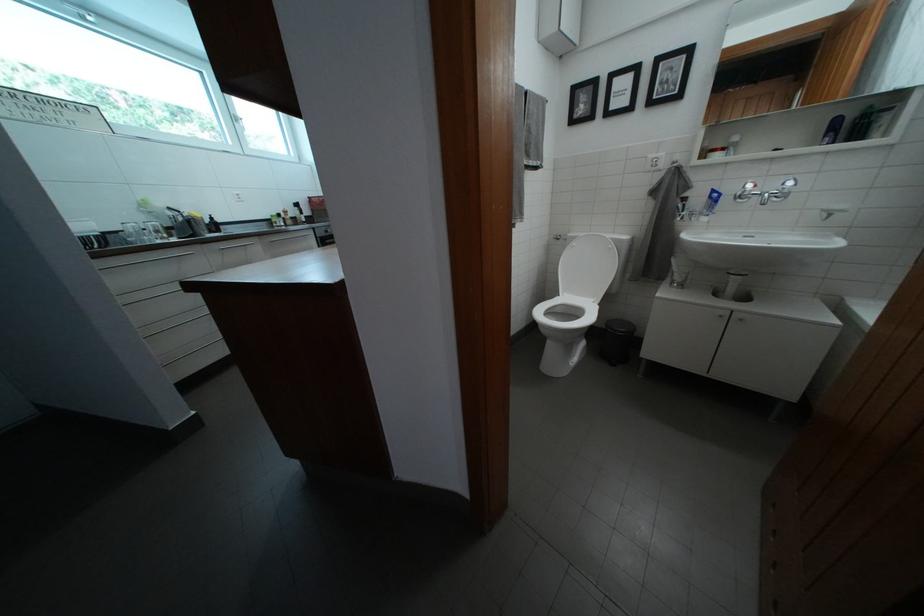
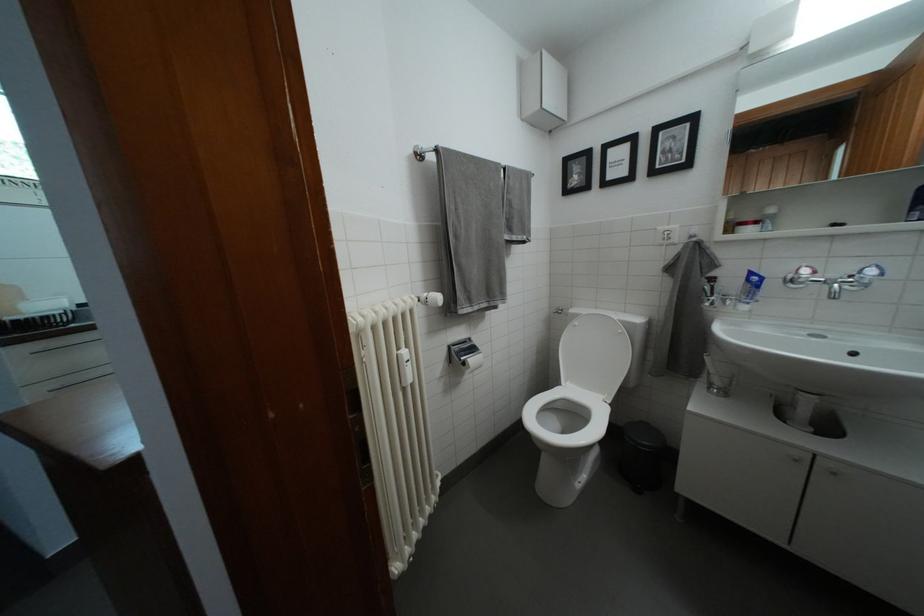
Locate, in the second image, the point that corresponds to (677,284) in the first image.

(714, 382)